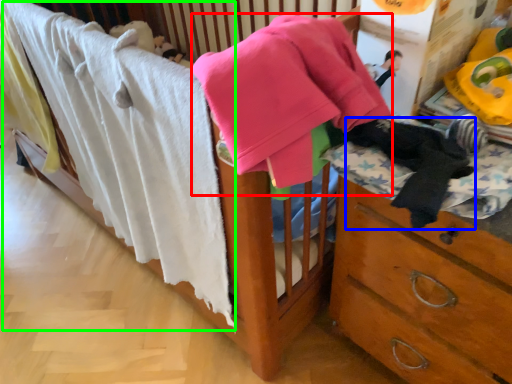
Question: Estimate the real-world distances between objects in this image. Which object is farther from baby clothe (highlighted by a red box), clothing (highlighted by a blue box) or bath towel (highlighted by a green box)?

Choices:
 (A) clothing
 (B) bath towel

Answer: (B)